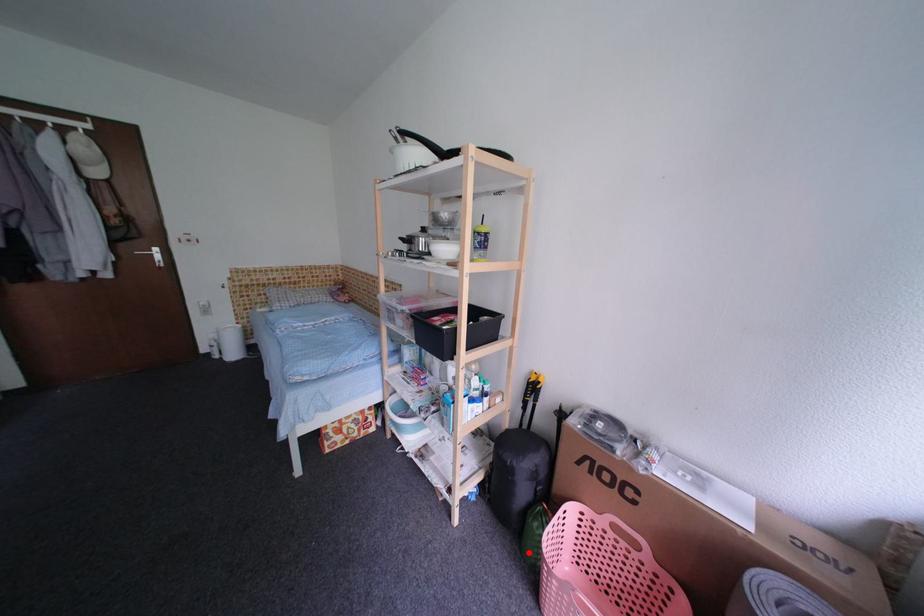
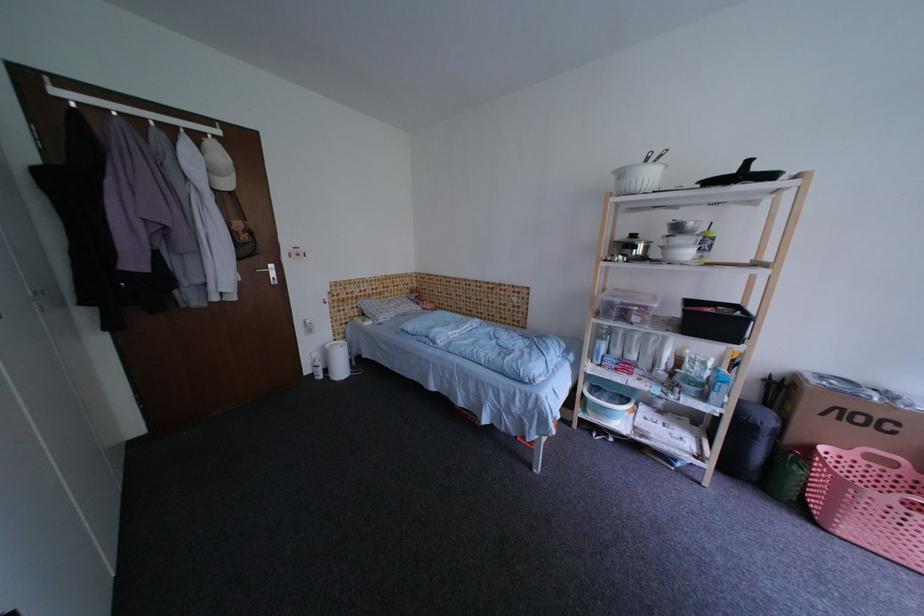
Question: I am providing you with two images of the same scene from different viewpoints. Image1 has a red point marked. In image2, the corresponding 3D location appears at what relative position? Reply with the corresponding letter.

Choices:
 (A) Closer
 (B) Farther

Answer: (A)